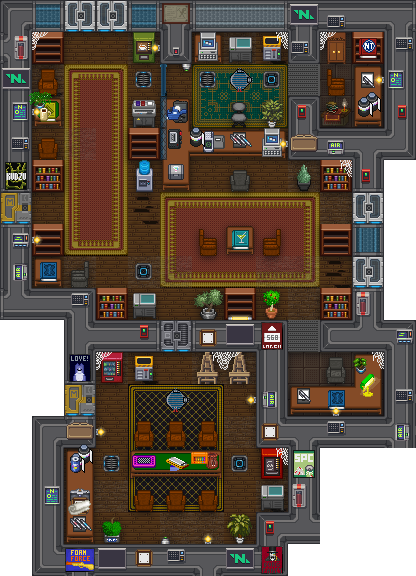
What are the coordinates of `pens` in the screenshot? It's located at tap(235, 141), tap(241, 142), tap(246, 142), tap(369, 79), tap(303, 394), tap(74, 524), tap(81, 522), tap(84, 522).